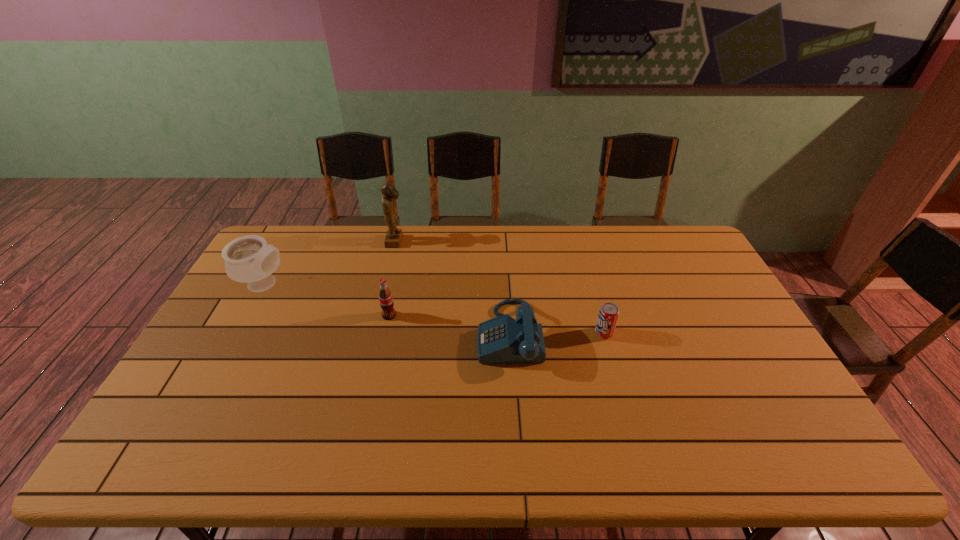
Identify the location of vacant space at the left edge. This screenshot has width=960, height=540. (228, 333).

The height and width of the screenshot is (540, 960). In the image, there is a desktop. Find the location of `vacant space at the right edge`. vacant space at the right edge is located at coordinates (705, 286).

In the image, there is a desktop. Identify the location of vacant region at the near left corner. (189, 443).

Find the location of a particular element. free space at the far right corner of the desktop is located at coordinates 649,227.

Locate an element on the screen. This screenshot has height=540, width=960. free space between the figurine and the fourth object from left to right is located at coordinates (452, 288).

What are the coordinates of `vacant point located between the farthest object and the fourth object from left to right` in the screenshot? It's located at (452, 288).

This screenshot has height=540, width=960. I want to click on free space between the tallest object and the pottery, so [x=331, y=263].

Locate an element on the screen. The image size is (960, 540). vacant area that lies between the left soda can and the second object from right to left is located at coordinates (449, 325).

The height and width of the screenshot is (540, 960). I want to click on empty space that is in between the leftmost object and the rightmost object, so click(x=435, y=309).

This screenshot has width=960, height=540. What are the coordinates of `free space between the telephone and the figurine` in the screenshot? It's located at (452, 288).